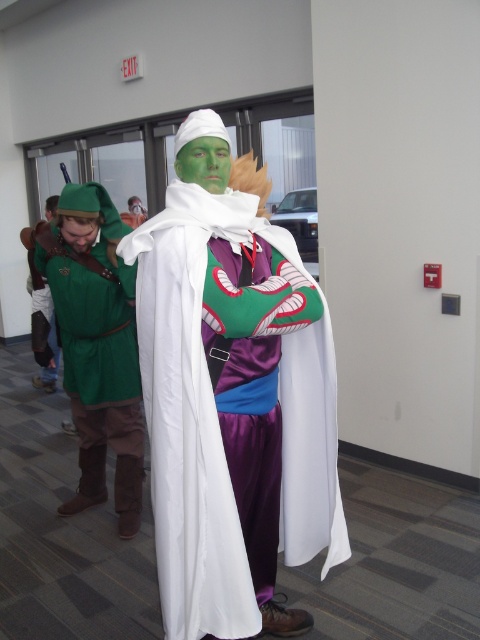
Question: From the image, what is the correct spatial relationship of satin green cape at center in relation to green matte tunic at left?

Choices:
 (A) above
 (B) below

Answer: (B)

Question: Which point is farther from the camera taking this photo?

Choices:
 (A) [96, 449]
 (B) [304, 502]

Answer: (A)

Question: Observing the image, what is the correct spatial positioning of satin green cape at center in reference to green matte tunic at left?

Choices:
 (A) below
 (B) above

Answer: (A)

Question: Can you confirm if satin green cape at center is positioned to the right of green matte tunic at left?

Choices:
 (A) yes
 (B) no

Answer: (A)

Question: Which object appears closest to the camera in this image?

Choices:
 (A) satin green cape at center
 (B) green matte tunic at left

Answer: (A)

Question: Which object is farther from the camera taking this photo?

Choices:
 (A) green matte tunic at left
 (B) satin green cape at center

Answer: (A)